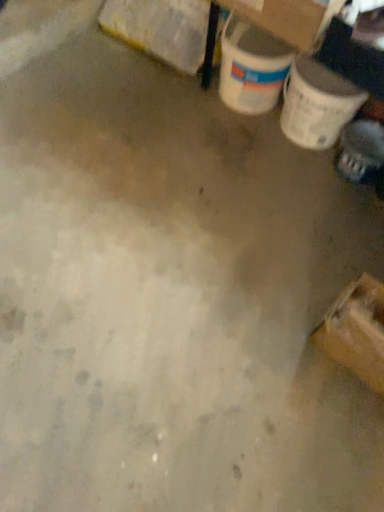
Find the location of `shiny black shoe at lower right`. shiny black shoe at lower right is located at coordinates (360, 151).

What do you see at coordinates (161, 29) in the screenshot? The height and width of the screenshot is (512, 384). I see `yellow cardboard box at upper left, marked as the 1th cardboard box in a left-to-right arrangement` at bounding box center [161, 29].

The height and width of the screenshot is (512, 384). In order to click on shiny black shoe at lower right in this screenshot , I will do `click(360, 151)`.

Considering the relative sizes of cardboard box at upper right, placed as the second cardboard box when sorted from back to front, and yellow cardboard box at upper left, which is the 2th cardboard box in front-to-back order, in the image provided, is cardboard box at upper right, placed as the second cardboard box when sorted from back to front, wider than yellow cardboard box at upper left, which is the 2th cardboard box in front-to-back order,?

Yes.

From a real-world perspective, relative to yellow cardboard box at upper left, which is the first cardboard box in back-to-front order, is cardboard box at upper right, the 2th cardboard box from the left, vertically above or below?

From a real-world perspective, cardboard box at upper right, the 2th cardboard box from the left, is physically above yellow cardboard box at upper left, which is the first cardboard box in back-to-front order.

Does cardboard box at upper right, which is counted as the first cardboard box, starting from the front, touch yellow cardboard box at upper left, marked as the 1th cardboard box in a left-to-right arrangement?

No, cardboard box at upper right, which is counted as the first cardboard box, starting from the front, is not beside yellow cardboard box at upper left, marked as the 1th cardboard box in a left-to-right arrangement.

This screenshot has width=384, height=512. Find the location of `cardboard box behind the shiny black shoe at lower right`. cardboard box behind the shiny black shoe at lower right is located at coordinates (161, 29).

Is yellow cardboard box at upper left, which is the 2th cardboard box in front-to-back order, to the left of shiny black shoe at lower right from the viewer's perspective?

Yes, yellow cardboard box at upper left, which is the 2th cardboard box in front-to-back order, is to the left of shiny black shoe at lower right.

Based on their sizes in the image, would you say yellow cardboard box at upper left, which is the 2th cardboard box in front-to-back order, is bigger or smaller than shiny black shoe at lower right?

yellow cardboard box at upper left, which is the 2th cardboard box in front-to-back order, is bigger than shiny black shoe at lower right.

How much distance is there between yellow cardboard box at upper left, which is the 2th cardboard box in front-to-back order, and cardboard box at upper right, placed as the second cardboard box when sorted from back to front?

The distance of yellow cardboard box at upper left, which is the 2th cardboard box in front-to-back order, from cardboard box at upper right, placed as the second cardboard box when sorted from back to front, is 14.83 inches.

In the image, is yellow cardboard box at upper left, which is the first cardboard box in back-to-front order, positioned in front of or behind cardboard box at upper right, the first cardboard box viewed from the right?

yellow cardboard box at upper left, which is the first cardboard box in back-to-front order, is positioned farther from the viewer than cardboard box at upper right, the first cardboard box viewed from the right.

Image resolution: width=384 pixels, height=512 pixels. I want to click on cardboard box in front of the yellow cardboard box at upper left, the 2th cardboard box when ordered from right to left, so click(288, 18).

Based on the photo, which object is wider, yellow cardboard box at upper left, marked as the 1th cardboard box in a left-to-right arrangement, or cardboard box at upper right, placed as the second cardboard box when sorted from back to front?

Wider between the two is cardboard box at upper right, placed as the second cardboard box when sorted from back to front.

Does shiny black shoe at lower right have a lesser height compared to yellow cardboard box at upper left, marked as the 1th cardboard box in a left-to-right arrangement?

Yes, shiny black shoe at lower right is shorter than yellow cardboard box at upper left, marked as the 1th cardboard box in a left-to-right arrangement.

Considering the points (383, 140) and (117, 31), which point is in front, point (383, 140) or point (117, 31)?

Positioned in front is point (383, 140).

From a real-world perspective, is shiny black shoe at lower right physically above yellow cardboard box at upper left, which is the 2th cardboard box in front-to-back order?

Incorrect, from a real-world perspective, shiny black shoe at lower right is lower than yellow cardboard box at upper left, which is the 2th cardboard box in front-to-back order.

Consider the image. Is shiny black shoe at lower right facing away from yellow cardboard box at upper left, the 2th cardboard box when ordered from right to left?

No, shiny black shoe at lower right is not facing the opposite direction of yellow cardboard box at upper left, the 2th cardboard box when ordered from right to left.

From the image's perspective, would you say shiny black shoe at lower right is shown under cardboard box at upper right, the 2th cardboard box from the left?

Correct, shiny black shoe at lower right appears lower than cardboard box at upper right, the 2th cardboard box from the left, in the image.

Does shiny black shoe at lower right contain cardboard box at upper right, the first cardboard box viewed from the right?

No, cardboard box at upper right, the first cardboard box viewed from the right, is located outside of shiny black shoe at lower right.

Can you confirm if shiny black shoe at lower right is smaller than cardboard box at upper right, the 2th cardboard box from the left?

Yes, shiny black shoe at lower right is smaller than cardboard box at upper right, the 2th cardboard box from the left.

Considering the relative sizes of cardboard box at upper right, the 2th cardboard box from the left, and shiny black shoe at lower right in the image provided, is cardboard box at upper right, the 2th cardboard box from the left, thinner than shiny black shoe at lower right?

In fact, cardboard box at upper right, the 2th cardboard box from the left, might be wider than shiny black shoe at lower right.

Which object is closer to the camera, cardboard box at upper right, which is counted as the first cardboard box, starting from the front, or shiny black shoe at lower right?

cardboard box at upper right, which is counted as the first cardboard box, starting from the front, is closer to the camera.

From the image's perspective, is cardboard box at upper right, the 2th cardboard box from the left, positioned above or below shiny black shoe at lower right?

Based on their image positions, cardboard box at upper right, the 2th cardboard box from the left, is located above shiny black shoe at lower right.

Are cardboard box at upper right, the 2th cardboard box from the left, and shiny black shoe at lower right located far from each other?

No, cardboard box at upper right, the 2th cardboard box from the left, is not far away from shiny black shoe at lower right.

Where is `cardboard box on the right of yellow cardboard box at upper left, the 2th cardboard box when ordered from right to left`? This screenshot has height=512, width=384. cardboard box on the right of yellow cardboard box at upper left, the 2th cardboard box when ordered from right to left is located at coordinates (288, 18).

Find the location of a particular element. The image size is (384, 512). the 2nd cardboard box counting from the left of the shiny black shoe at lower right is located at coordinates 161,29.

In the scene shown: When comparing their distances from cardboard box at upper right, the first cardboard box viewed from the right, does yellow cardboard box at upper left, the 2th cardboard box when ordered from right to left, or shiny black shoe at lower right seem closer?

The object closer to cardboard box at upper right, the first cardboard box viewed from the right, is yellow cardboard box at upper left, the 2th cardboard box when ordered from right to left.

Looking at the image, which one is located further to cardboard box at upper right, the first cardboard box viewed from the right, shiny black shoe at lower right or yellow cardboard box at upper left, the 2th cardboard box when ordered from right to left?

shiny black shoe at lower right is positioned further to the anchor cardboard box at upper right, the first cardboard box viewed from the right.

When comparing their distances from shiny black shoe at lower right, does cardboard box at upper right, which is counted as the first cardboard box, starting from the front, or yellow cardboard box at upper left, the 2th cardboard box when ordered from right to left, seem closer?

cardboard box at upper right, which is counted as the first cardboard box, starting from the front.

Estimate the real-world distances between objects in this image. Which object is closer to yellow cardboard box at upper left, which is the 2th cardboard box in front-to-back order, cardboard box at upper right, the first cardboard box viewed from the right, or shiny black shoe at lower right?

cardboard box at upper right, the first cardboard box viewed from the right, lies closer to yellow cardboard box at upper left, which is the 2th cardboard box in front-to-back order, than the other object.

Considering their positions, is shiny black shoe at lower right positioned closer to yellow cardboard box at upper left, the 2th cardboard box when ordered from right to left, than cardboard box at upper right, the first cardboard box viewed from the right?

→ The object closer to yellow cardboard box at upper left, the 2th cardboard box when ordered from right to left, is cardboard box at upper right, the first cardboard box viewed from the right.

Which object lies further to the anchor point shiny black shoe at lower right, yellow cardboard box at upper left, the 2th cardboard box when ordered from right to left, or cardboard box at upper right, the 2th cardboard box from the left?

yellow cardboard box at upper left, the 2th cardboard box when ordered from right to left, is positioned further to the anchor shiny black shoe at lower right.

I want to click on cardboard box located between yellow cardboard box at upper left, which is the 2th cardboard box in front-to-back order, and shiny black shoe at lower right in the left-right direction, so click(x=288, y=18).